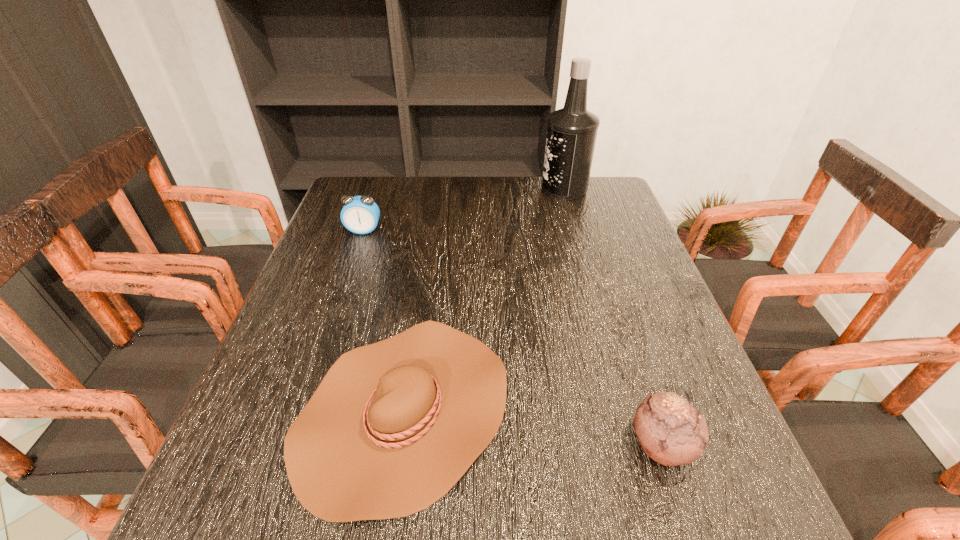
This screenshot has width=960, height=540. I want to click on vacant point located on the back of the shortest object, so click(x=419, y=310).

Find the location of a particular element. object that is at the far edge is located at coordinates (571, 133).

Where is `object that is at the near edge`? This screenshot has height=540, width=960. object that is at the near edge is located at coordinates (393, 426).

The height and width of the screenshot is (540, 960). I want to click on alarm clock that is at the left edge, so click(360, 214).

You are a GUI agent. You are given a task and a screenshot of the screen. Output one action in this format:
    pyautogui.click(x=<x>, y=<y>)
    Task: Click on the cowboy hat present at the left edge
    
    Given the screenshot: What is the action you would take?
    pyautogui.click(x=393, y=426)

I want to click on liquor that is at the right edge, so click(x=571, y=133).

I want to click on muffin that is positioned at the right edge, so click(x=671, y=431).

The height and width of the screenshot is (540, 960). I want to click on object that is at the near left corner, so click(x=393, y=426).

Identify the location of object at the far right corner. The height and width of the screenshot is (540, 960). (571, 133).

Locate an element on the screen. free space at the far edge is located at coordinates pos(529,195).